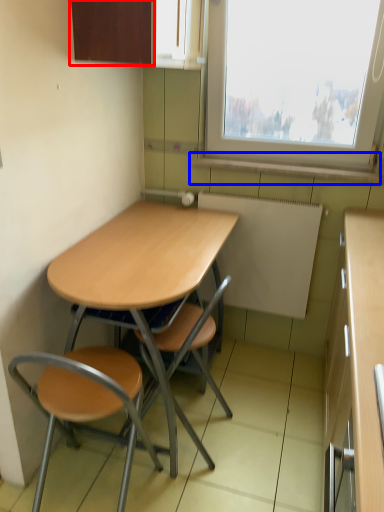
Question: Which object is closer to the camera taking this photo, cabinetry (highlighted by a red box) or window sill (highlighted by a blue box)?

Choices:
 (A) cabinetry
 (B) window sill

Answer: (A)